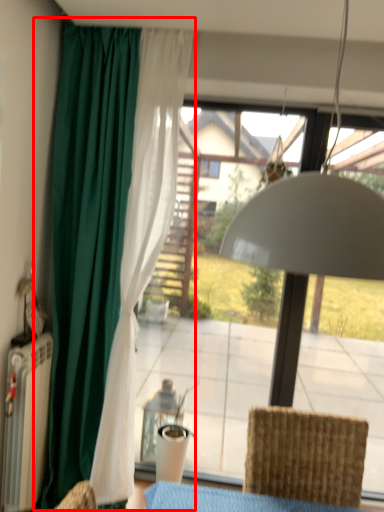
Question: From the image's perspective, where is curtain (annotated by the red box) located in relation to chair in the image?

Choices:
 (A) above
 (B) below

Answer: (A)